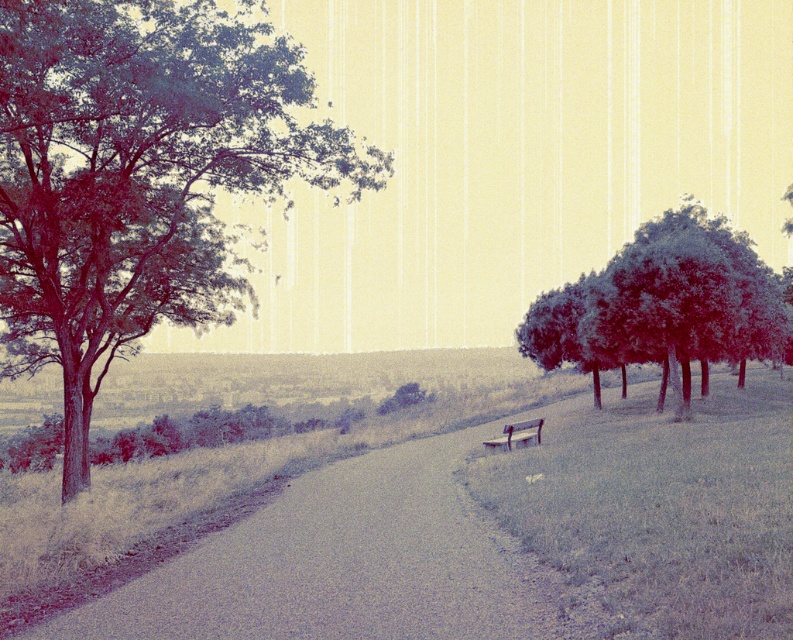
Question: Which object is farther from the camera taking this photo?

Choices:
 (A) wooden park bench at center
 (B) smooth brown tree at left
 (C) smooth asphalt road at center

Answer: (A)

Question: Which of the following is the closest to the observer?

Choices:
 (A) smooth green trees at right
 (B) wooden park bench at center

Answer: (B)

Question: Is smooth green trees at right behind wooden park bench at center?

Choices:
 (A) yes
 (B) no

Answer: (A)

Question: Estimate the real-world distances between objects in this image. Which object is closer to the smooth asphalt road at center?

Choices:
 (A) smooth green trees at right
 (B) wooden park bench at center

Answer: (B)

Question: Is smooth brown tree at left positioned at the back of smooth green trees at right?

Choices:
 (A) yes
 (B) no

Answer: (B)

Question: Does smooth brown tree at left have a lesser width compared to smooth green trees at right?

Choices:
 (A) no
 (B) yes

Answer: (A)